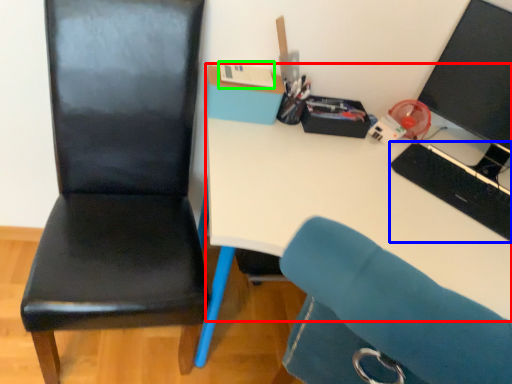
Question: Which object is the closest to the desk (highlighted by a red box)? Choose among these: keyboard (highlighted by a blue box) or stationery (highlighted by a green box).

Choices:
 (A) keyboard
 (B) stationery

Answer: (A)